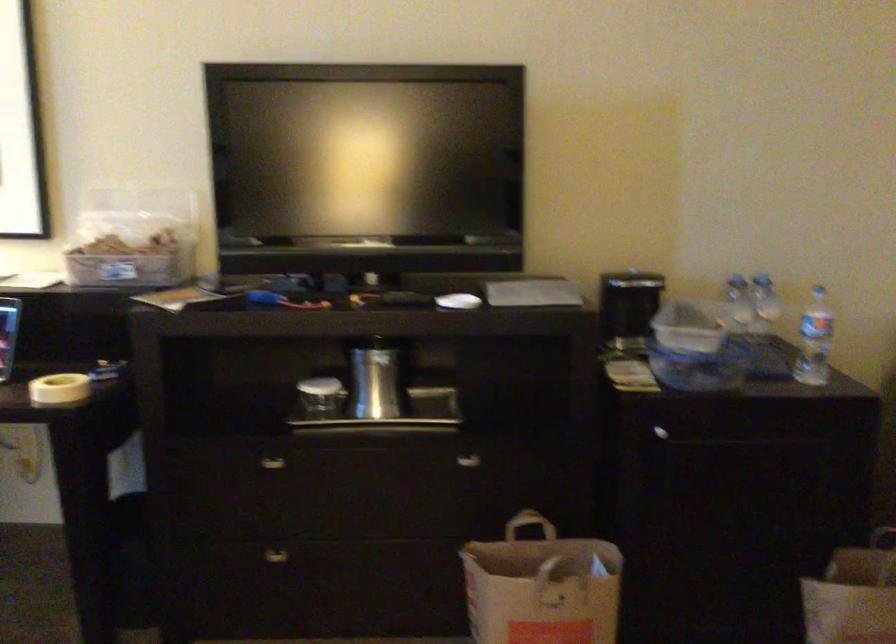
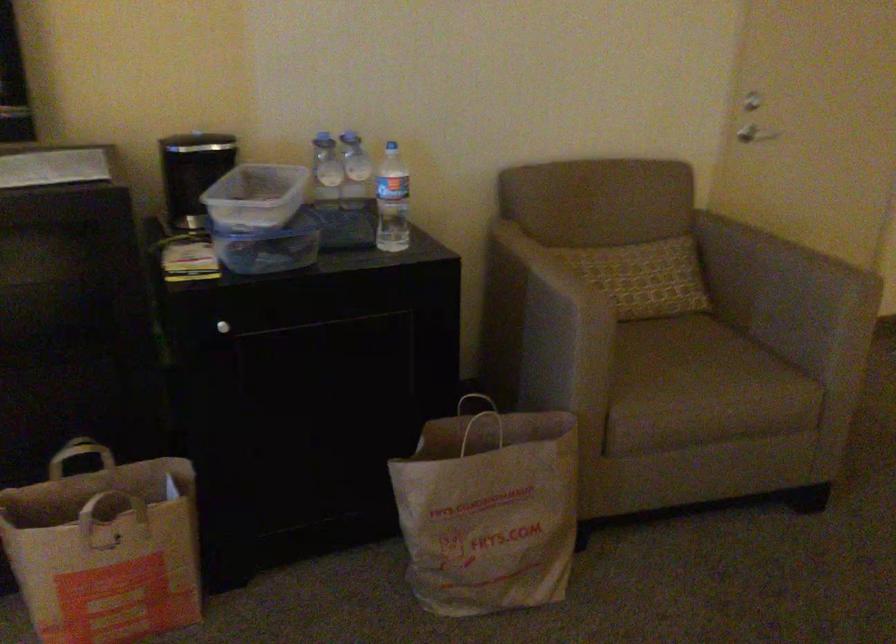
Find the pixel in the second image that matches pixel 530 527 in the first image.

(82, 458)